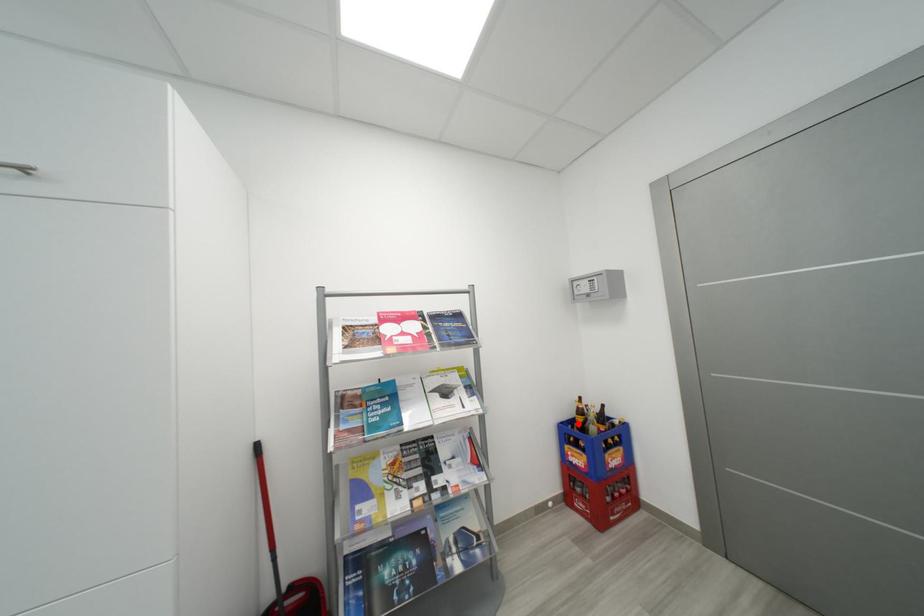
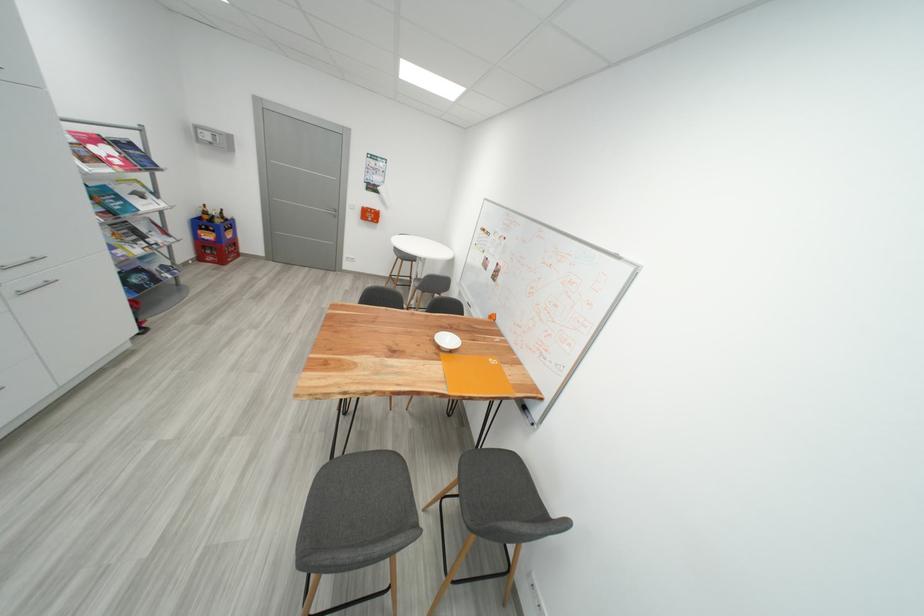
Locate, in the second image, the point that corresponds to the highlighted location in the first image.

(208, 220)